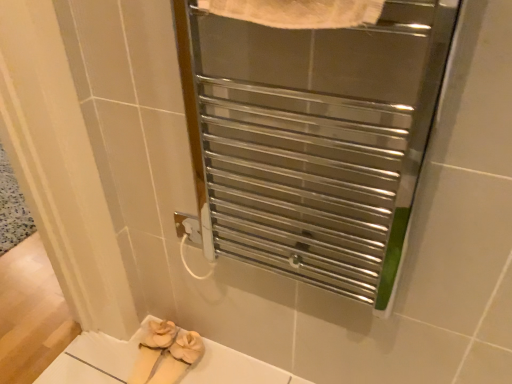
The width and height of the screenshot is (512, 384). What do you see at coordinates (313, 138) in the screenshot?
I see `polished metal towel warmer at upper center` at bounding box center [313, 138].

What are the coordinates of `polished metal towel warmer at upper center` in the screenshot? It's located at (313, 138).

The height and width of the screenshot is (384, 512). What are the coordinates of `white soft slippers at lower center` in the screenshot? It's located at tap(166, 354).

In the scene shown: Measure the distance between point (175,350) and camera.

Point (175,350) is 4.32 feet from camera.

The height and width of the screenshot is (384, 512). What do you see at coordinates (166, 354) in the screenshot?
I see `white soft slippers at lower center` at bounding box center [166, 354].

Image resolution: width=512 pixels, height=384 pixels. In order to click on polished metal towel warmer at upper center in this screenshot , I will do `click(313, 138)`.

Considering the relative positions of polished metal towel warmer at upper center and white soft slippers at lower center in the image provided, is polished metal towel warmer at upper center to the left or to the right of white soft slippers at lower center?

Based on their positions, polished metal towel warmer at upper center is located to the right of white soft slippers at lower center.

Considering their positions, is polished metal towel warmer at upper center located in front of or behind white soft slippers at lower center?

polished metal towel warmer at upper center is positioned closer to the viewer than white soft slippers at lower center.

Is point (306, 187) closer or farther from the camera than point (136, 371)?

Point (306, 187) is closer to the camera than point (136, 371).

From the image's perspective, is polished metal towel warmer at upper center positioned above or below white soft slippers at lower center?

Clearly, from the image's perspective, polished metal towel warmer at upper center is above white soft slippers at lower center.

From a real-world perspective, is polished metal towel warmer at upper center physically located above or below white soft slippers at lower center?

polished metal towel warmer at upper center is above white soft slippers at lower center.

Does polished metal towel warmer at upper center have a lesser width compared to white soft slippers at lower center?

Correct, the width of polished metal towel warmer at upper center is less than that of white soft slippers at lower center.

Does polished metal towel warmer at upper center have a greater height compared to white soft slippers at lower center?

Correct, polished metal towel warmer at upper center is much taller as white soft slippers at lower center.

Between polished metal towel warmer at upper center and white soft slippers at lower center, which one has smaller size?

Smaller between the two is white soft slippers at lower center.

Is polished metal towel warmer at upper center completely or partially outside of white soft slippers at lower center?

Yes, polished metal towel warmer at upper center is located beyond the bounds of white soft slippers at lower center.

Is polished metal towel warmer at upper center next to white soft slippers at lower center and touching it?

No, polished metal towel warmer at upper center is not with white soft slippers at lower center.

In the scene shown: Could you tell me if polished metal towel warmer at upper center is facing white soft slippers at lower center?

No, polished metal towel warmer at upper center is not turned towards white soft slippers at lower center.

What's the angular difference between polished metal towel warmer at upper center and white soft slippers at lower center's facing directions?

The angle between the facing direction of polished metal towel warmer at upper center and the facing direction of white soft slippers at lower center is 0.617 degrees.

How far apart are polished metal towel warmer at upper center and white soft slippers at lower center?

The distance of polished metal towel warmer at upper center from white soft slippers at lower center is 26.86 inches.

Where is `screen door in front of the white soft slippers at lower center`? screen door in front of the white soft slippers at lower center is located at coordinates (313, 138).

Does white soft slippers at lower center appear on the left side of polished metal towel warmer at upper center?

Yes.

In the image, is white soft slippers at lower center positioned in front of or behind polished metal towel warmer at upper center?

Clearly, white soft slippers at lower center is behind polished metal towel warmer at upper center.

Is point (195, 352) closer to camera compared to point (185, 54)?

No, (195, 352) is further to viewer.

From the image's perspective, is white soft slippers at lower center above or below polished metal towel warmer at upper center?

Based on their image positions, white soft slippers at lower center is located beneath polished metal towel warmer at upper center.

From a real-world perspective, who is located higher, white soft slippers at lower center or polished metal towel warmer at upper center?

polished metal towel warmer at upper center is physically above.

Between white soft slippers at lower center and polished metal towel warmer at upper center, which one has smaller width?

polished metal towel warmer at upper center is thinner.

Is white soft slippers at lower center taller than polished metal towel warmer at upper center?

Incorrect, the height of white soft slippers at lower center is not larger of that of polished metal towel warmer at upper center.

Who is bigger, white soft slippers at lower center or polished metal towel warmer at upper center?

With larger size is polished metal towel warmer at upper center.

Which is correct: white soft slippers at lower center is inside polished metal towel warmer at upper center, or outside of it?

white soft slippers at lower center is spatially situated outside polished metal towel warmer at upper center.

Is white soft slippers at lower center not close to polished metal towel warmer at upper center?

No, white soft slippers at lower center is not far away from polished metal towel warmer at upper center.

Is white soft slippers at lower center facing away from polished metal towel warmer at upper center?

No, white soft slippers at lower center's orientation is not away from polished metal towel warmer at upper center.

Can you tell me how much white soft slippers at lower center and polished metal towel warmer at upper center differ in facing direction?

The facing directions of white soft slippers at lower center and polished metal towel warmer at upper center are 0.617 degrees apart.

Identify the location of screen door above the white soft slippers at lower center (from the image's perspective). (313, 138).

Identify the location of footwear that is below the polished metal towel warmer at upper center (from the image's perspective). The height and width of the screenshot is (384, 512). (166, 354).

The width and height of the screenshot is (512, 384). Find the location of `screen door above the white soft slippers at lower center (from a real-world perspective)`. screen door above the white soft slippers at lower center (from a real-world perspective) is located at coordinates (313, 138).